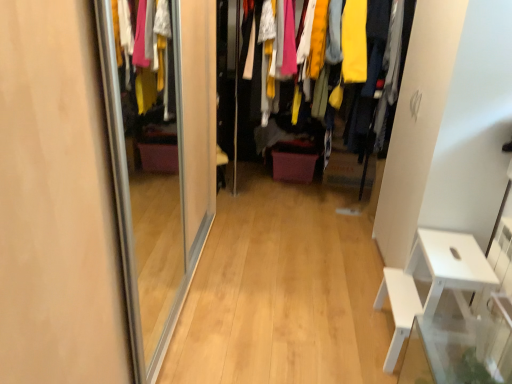
Question: Considering their positions, is white plastic table at right located in front of or behind textured fabric clothes at center?

Choices:
 (A) front
 (B) behind

Answer: (A)

Question: In the image, is white plastic table at right on the left side or the right side of textured fabric clothes at center?

Choices:
 (A) left
 (B) right

Answer: (B)

Question: Is point (399, 281) positioned closer to the camera than point (249, 137)?

Choices:
 (A) closer
 (B) farther

Answer: (A)

Question: Is textured fabric clothes at center spatially inside white plastic table at right, or outside of it?

Choices:
 (A) outside
 (B) inside

Answer: (A)

Question: From the image's perspective, is textured fabric clothes at center above or below white plastic table at right?

Choices:
 (A) above
 (B) below

Answer: (A)

Question: Is textured fabric clothes at center wider or thinner than white plastic table at right?

Choices:
 (A) thin
 (B) wide

Answer: (B)

Question: Would you say textured fabric clothes at center is to the left or to the right of white plastic table at right in the picture?

Choices:
 (A) left
 (B) right

Answer: (A)